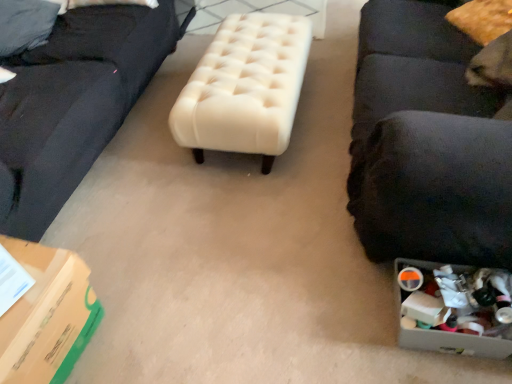
At what (x,y) coordinates should I click in order to perform the action: click on free space above plastic container at lower right (from a real-world perspective). Please return your answer as a coordinate pair (x, y). The image size is (512, 384). Looking at the image, I should click on (451, 301).